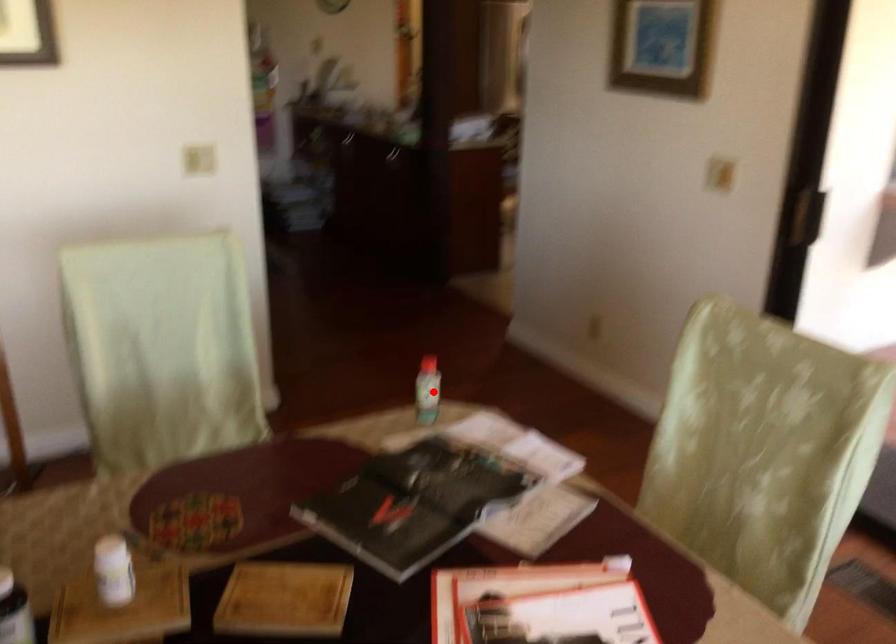
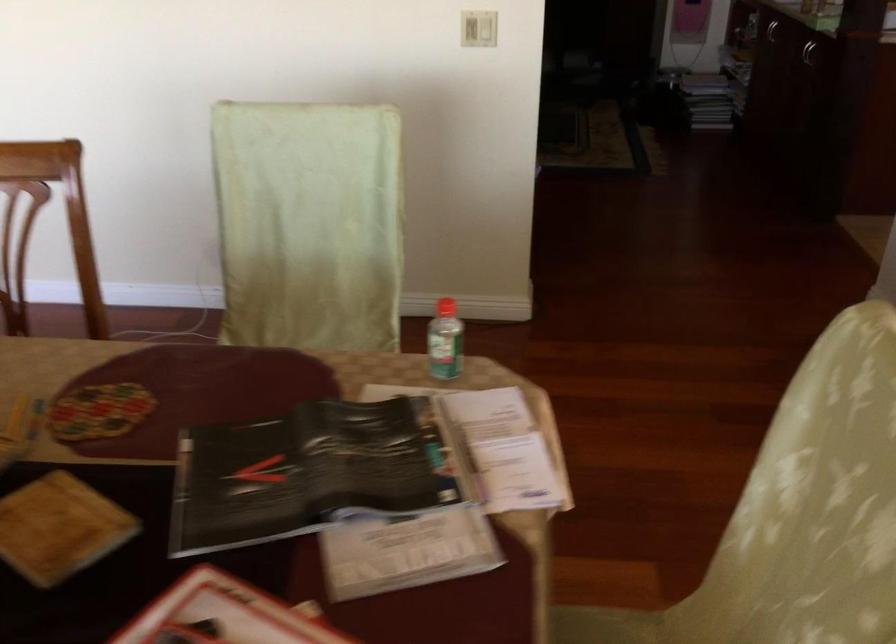
The point at the highlighted location is marked in the first image. Where is the corresponding point in the second image?

(444, 341)